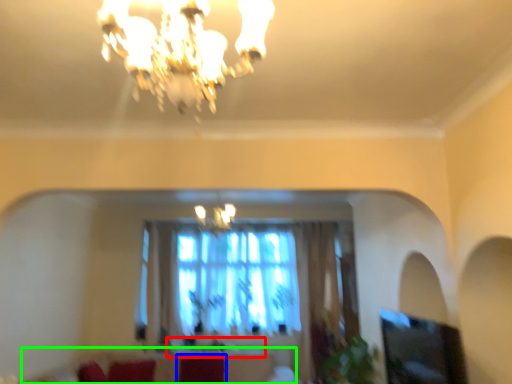
Question: Considering the real-world distances, which object is farthest from round table (highlighted by a red box)? swivel chair (highlighted by a blue box) or couch (highlighted by a green box)?

Choices:
 (A) swivel chair
 (B) couch

Answer: (A)